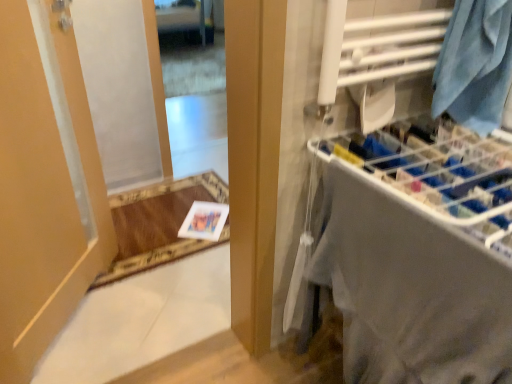
Question: Is matte beige door at left not within blue fabric at upper right?

Choices:
 (A) yes
 (B) no

Answer: (A)

Question: Is matte beige door at left turned away from blue fabric at upper right?

Choices:
 (A) yes
 (B) no

Answer: (B)

Question: From a real-world perspective, is matte beige door at left under blue fabric at upper right?

Choices:
 (A) yes
 (B) no

Answer: (A)

Question: Is matte beige door at left facing towards blue fabric at upper right?

Choices:
 (A) no
 (B) yes

Answer: (B)

Question: Can you confirm if matte beige door at left is wider than blue fabric at upper right?

Choices:
 (A) no
 (B) yes

Answer: (A)

Question: From the image's perspective, would you say matte beige door at left is positioned over blue fabric at upper right?

Choices:
 (A) yes
 (B) no

Answer: (B)

Question: Does clear glass mirror at upper center have a greater height compared to white fabric at right?

Choices:
 (A) no
 (B) yes

Answer: (B)

Question: Does clear glass mirror at upper center have a larger size compared to white fabric at right?

Choices:
 (A) yes
 (B) no

Answer: (B)

Question: Does clear glass mirror at upper center have a smaller size compared to white fabric at right?

Choices:
 (A) yes
 (B) no

Answer: (A)

Question: From a real-world perspective, does clear glass mirror at upper center stand above white fabric at right?

Choices:
 (A) no
 (B) yes

Answer: (B)

Question: Can you confirm if clear glass mirror at upper center is positioned to the right of white fabric at right?

Choices:
 (A) yes
 (B) no

Answer: (B)

Question: Is clear glass mirror at upper center touching white fabric at right?

Choices:
 (A) yes
 (B) no

Answer: (B)

Question: Is blue fabric at upper right at the right side of clear glass mirror at upper center?

Choices:
 (A) yes
 (B) no

Answer: (A)